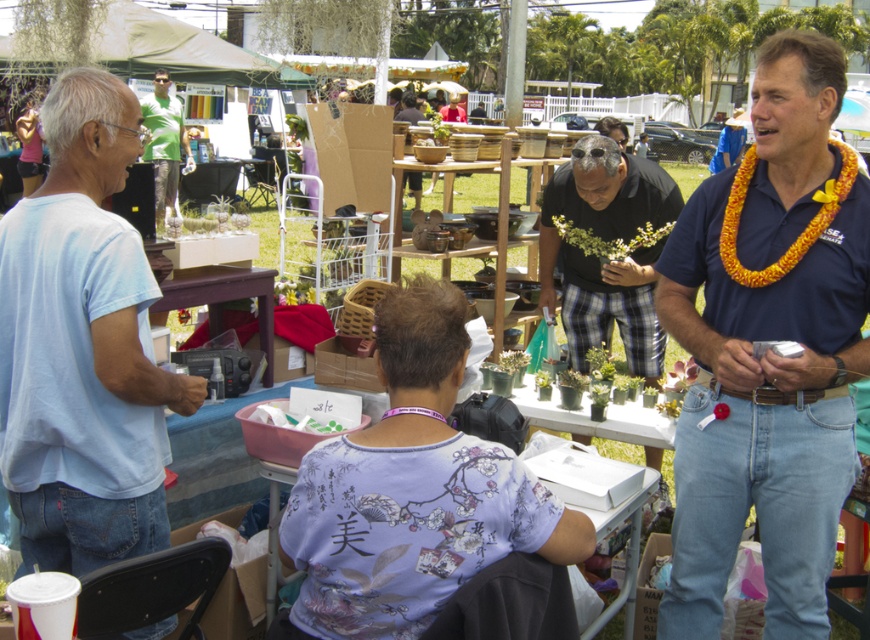
Looking at this image, what is located at the coordinates point (768, 349)?

The blue shirt at center is located at point (768, 349).